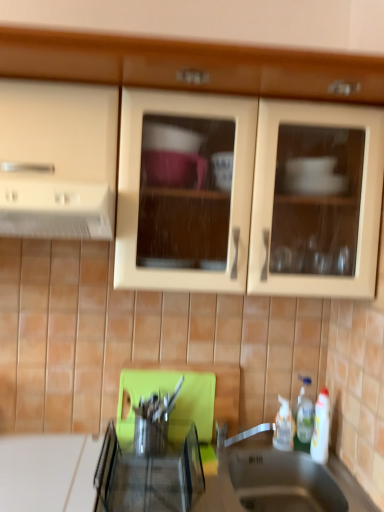
Question: Is white matte exhaust hood at left bigger or smaller than metallic stainless steel knife block at center?

Choices:
 (A) small
 (B) big

Answer: (B)

Question: In terms of height, does white matte exhaust hood at left look taller or shorter compared to metallic stainless steel knife block at center?

Choices:
 (A) tall
 (B) short

Answer: (A)

Question: Considering the real-world distances, which object is farthest from the metallic stainless steel knife block at center?

Choices:
 (A) white matte exhaust hood at left
 (B) white glossy bottle at lower right, the 1th bottle positioned from the right
 (C) white plastic bottle at lower right, acting as the 2th bottle starting from the right
 (D) metallic stainless steel sink at lower center
 (E) matte wood cabinets at upper center

Answer: (E)

Question: Which is farther from the white matte exhaust hood at left?

Choices:
 (A) metallic stainless steel sink at lower center
 (B) matte wood cabinets at upper center
 (C) white glossy bottle at lower right, the 1th bottle positioned from the right
 (D) metallic stainless steel knife block at center
 (E) white plastic bottle at lower right, acting as the 1th bottle starting from the left

Answer: (C)